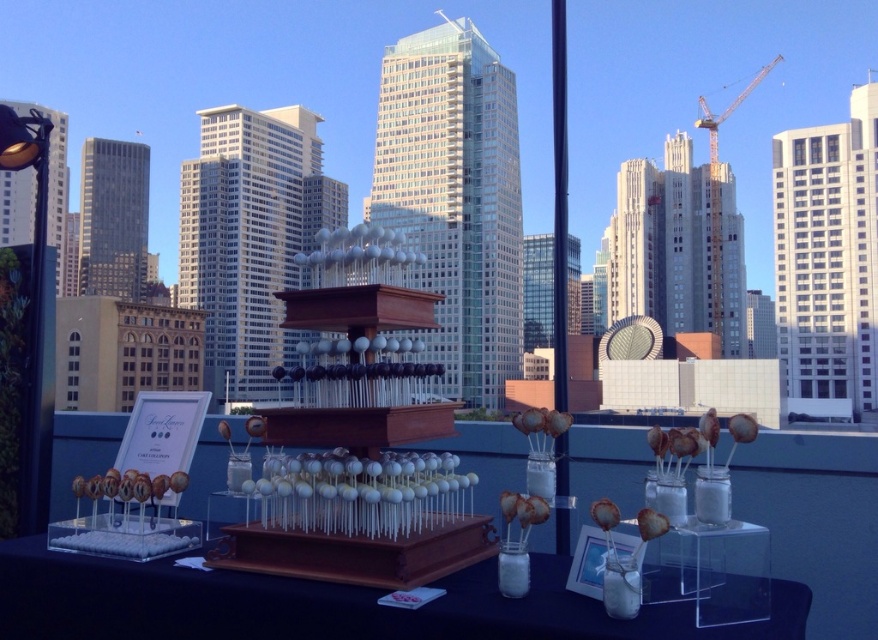
Who is positioned more to the left, clear acrylic table at center or white glossy cake pops at center?

From the viewer's perspective, white glossy cake pops at center appears more on the left side.

Is point (18, 630) positioned after point (321, 461)?

That is True.

Is point (58, 589) positioned after point (274, 467)?

Yes, point (58, 589) is behind point (274, 467).

Identify the location of clear acrylic table at center. (327, 604).

Does clear acrylic table at center appear under matte chocolate donut at lower left?

Indeed, clear acrylic table at center is positioned under matte chocolate donut at lower left.

Where is `clear acrylic table at center`? The image size is (878, 640). clear acrylic table at center is located at coordinates click(x=327, y=604).

Is white glossy cake pops at center to the right of matte chocolate donut at lower left from the viewer's perspective?

Correct, you'll find white glossy cake pops at center to the right of matte chocolate donut at lower left.

You are a GUI agent. You are given a task and a screenshot of the screen. Output one action in this format:
    pyautogui.click(x=<x>, y=<y>)
    Task: Click on the white glossy cake pops at center
    The image size is (878, 640).
    Given the screenshot: What is the action you would take?
    361,492

Which is behind, point (369, 513) or point (112, 483)?

Point (112, 483)

I want to click on white glossy cake pops at center, so click(361, 492).